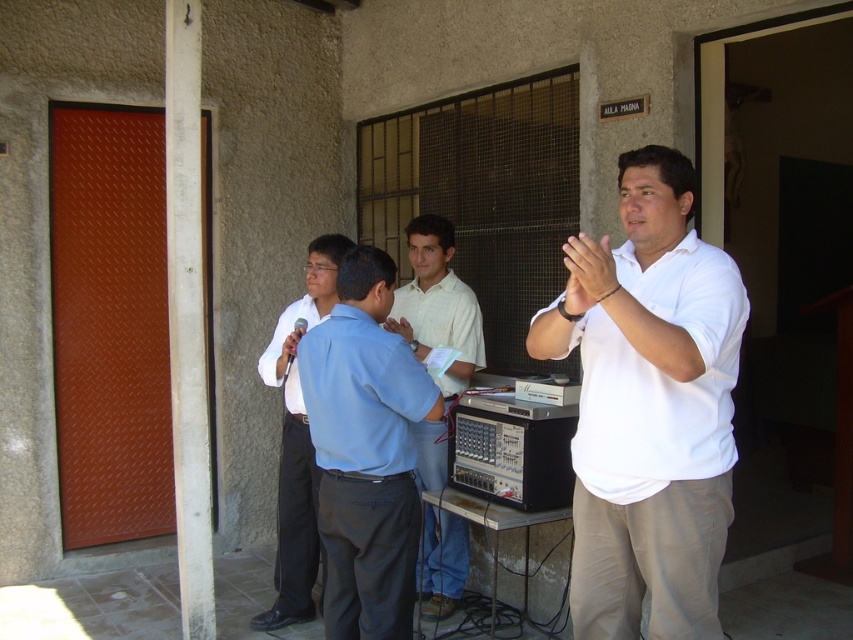
You are standing in front of the AULA MAGNA building and want to reach the red door with a diamond plate pattern on the left side. There is a point marked at coordinates (373, 513) in the image. Is this point closer to you than 3 meters?

The point at coordinates (373, 513) is 2.74 meters away from the viewer, so yes, it is closer than 3 meters.

You are organizing a group photo and need to arrange the participants by shirt width from largest to smallest. Given the white matte shirt at center and the light blue shirt at center, which order should they be placed in?

The white matte shirt at center should come first since it has a larger width than the light blue shirt at center.

You are a photographer trying to capture a clear shot of the white matte shirt at center and the light blue shirt at center. Based on their positions, which one is closer to the camera?

The white matte shirt at center is positioned over light blue shirt at center, so it is closer to the camera.